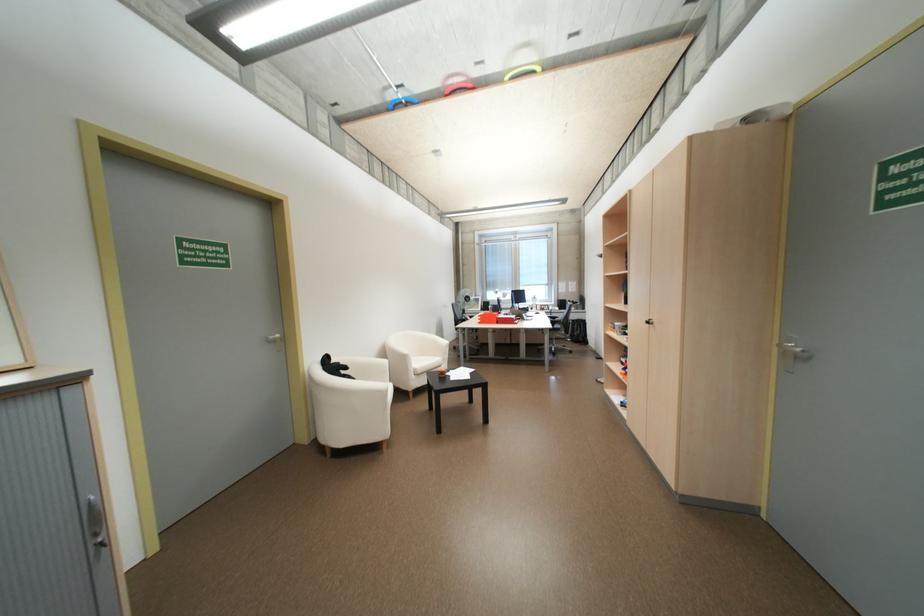
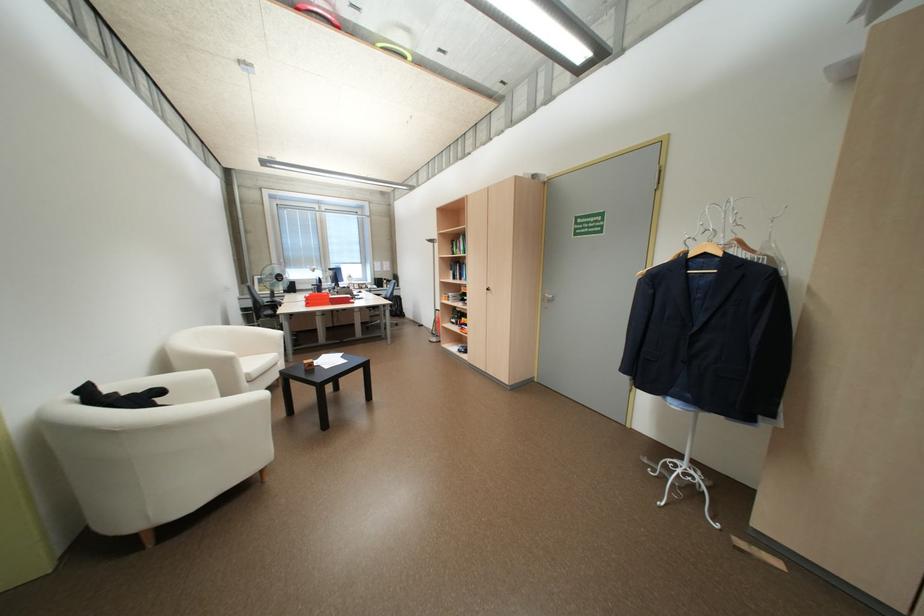
Question: The camera is either moving clockwise (left) or counter-clockwise (right) around the object. The first image is from the beginning of the video and the second image is from the end. Is the camera moving left or right when shooting the video?

Choices:
 (A) Left
 (B) Right

Answer: (A)